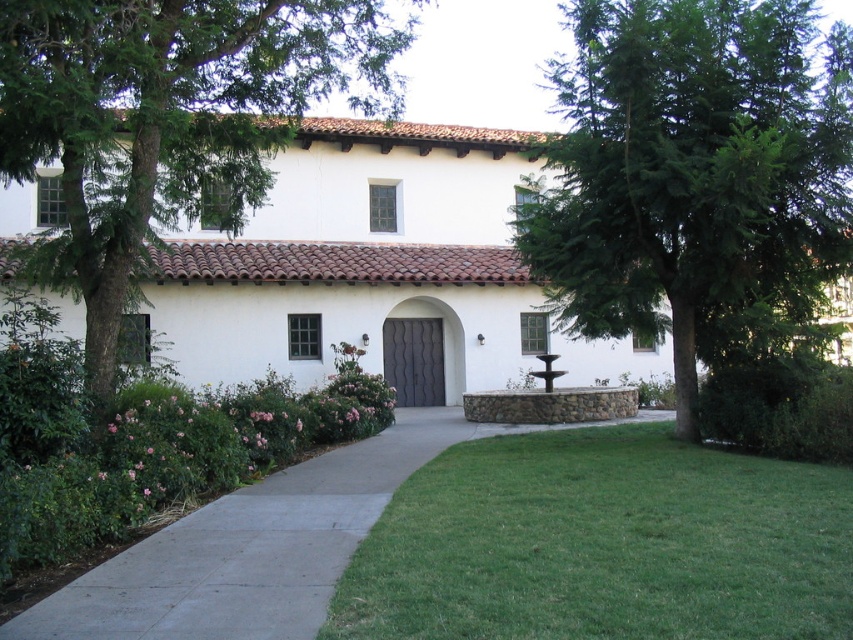
You are standing at the entrance of the white building with a Spanish colonial style. You want to walk towards the green leafy tree at center marked by point (695, 176). Which direction should you go from the entrance?

The green leafy tree at center marked by point (695, 176) is located at the center, so you should walk straight ahead from the entrance towards the center to reach it.

You are a gardener who wants to plant a new flower bed between the green leafy tree at center and the green grass at lower center. Considering their heights, which object will cast a shadow over the flower bed during the afternoon when the sun is lower in the sky?

The green leafy tree at center will cast a shadow over the flower bed because it is taller than the green grass at lower center.